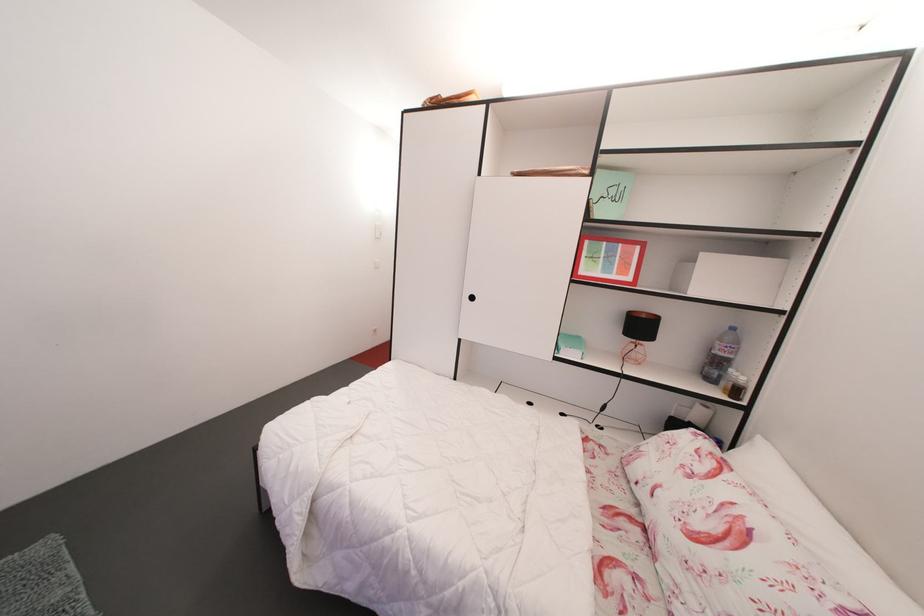
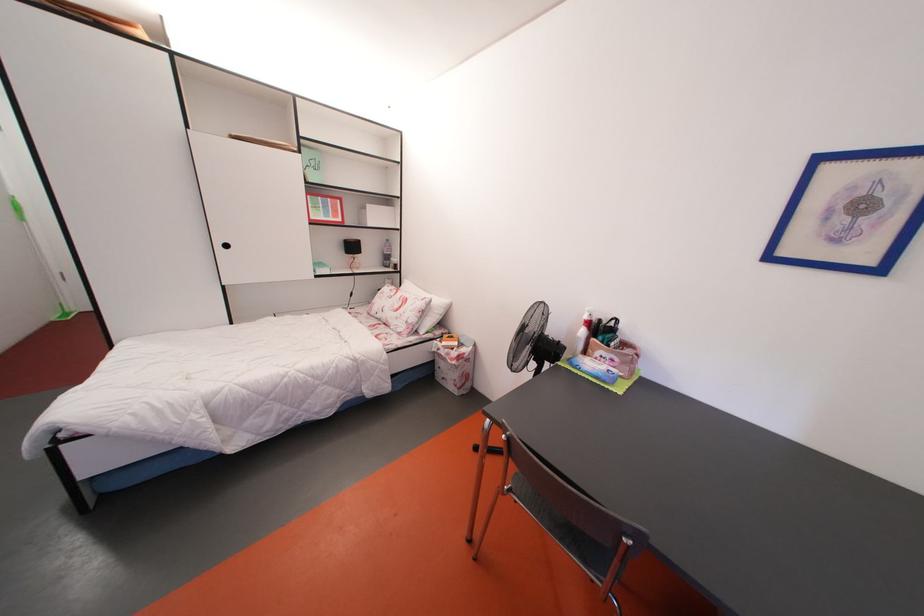
Find the pixel in the second image that matches point 647,331 in the first image.

(359, 253)